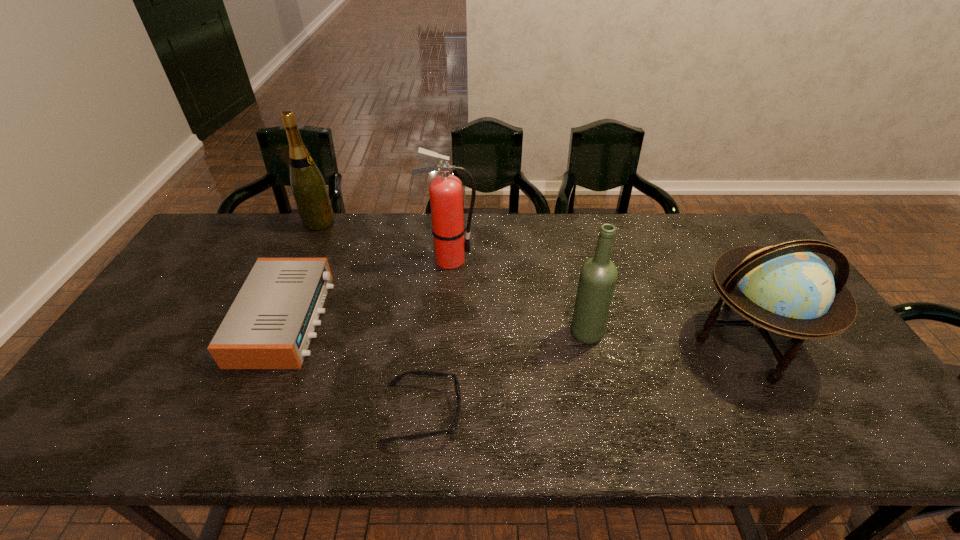
What are the coordinates of `vacant space located 0.400m on the back of the nearer wine bottle` in the screenshot? It's located at (564, 232).

Find the location of a particular element. Image resolution: width=960 pixels, height=540 pixels. free location located 0.090m on the surface of the globe is located at coordinates (795, 423).

Where is `free space located on the control panel of the fifth tallest object`? Image resolution: width=960 pixels, height=540 pixels. free space located on the control panel of the fifth tallest object is located at coordinates (390, 319).

Find the location of a particular element. Image resolution: width=960 pixels, height=540 pixels. vacant region located 0.320m on the front-facing side of the shortest object is located at coordinates (600, 413).

Where is `wine bottle present at the far edge`? wine bottle present at the far edge is located at coordinates (309, 189).

The width and height of the screenshot is (960, 540). What are the coordinates of `fire extinguisher that is positioned at the far edge` in the screenshot? It's located at (446, 191).

Find the location of a particular element. This screenshot has height=540, width=960. object positioned at the near edge is located at coordinates (457, 388).

The width and height of the screenshot is (960, 540). Identify the location of object present at the right edge. (786, 289).

Identify the location of vacant area at the far edge. The height and width of the screenshot is (540, 960). tap(573, 246).

Find the location of a particular element. The width and height of the screenshot is (960, 540). vacant area at the near edge of the desktop is located at coordinates (249, 429).